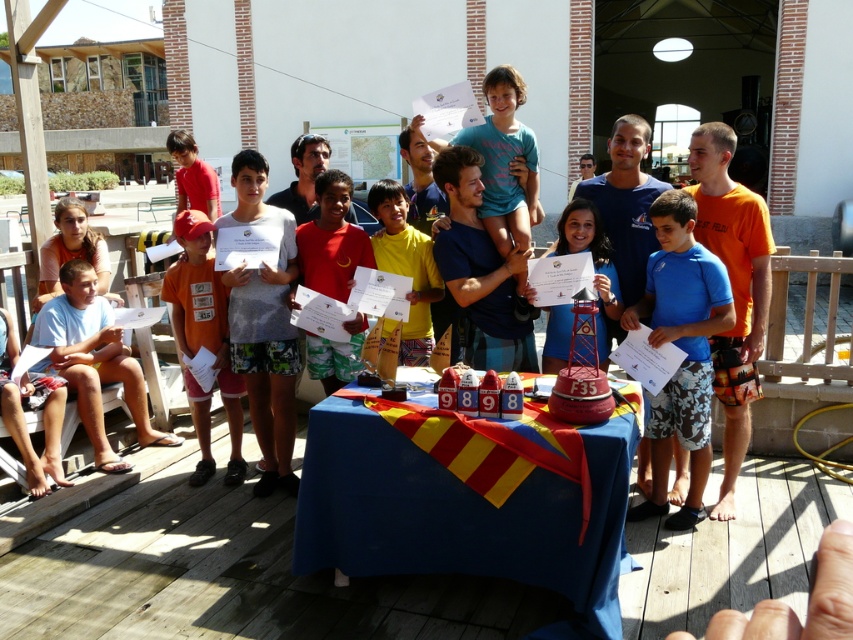
Can you confirm if matte orange t-shirt at center is shorter than yellow matte shirt at center?

In fact, matte orange t-shirt at center may be taller than yellow matte shirt at center.

I want to click on matte orange t-shirt at center, so click(x=204, y=321).

Between blue floral shorts at center and yellow matte shirt at center, which one appears on the left side from the viewer's perspective?

From the viewer's perspective, yellow matte shirt at center appears more on the left side.

Is point (668, 332) positioned after point (422, 269)?

No, it is not.

Between point (677, 525) and point (410, 260), which one is positioned behind?

The point (410, 260) is more distant.

You are a GUI agent. You are given a task and a screenshot of the screen. Output one action in this format:
    pyautogui.click(x=<x>, y=<y>)
    Task: Click on the blue floral shorts at center
    Image resolution: width=853 pixels, height=640 pixels.
    Given the screenshot: What is the action you would take?
    pyautogui.click(x=680, y=348)

Is matte orange t-shirt at center taller than red cotton shirt at center?

Yes.

Between matte orange t-shirt at center and red cotton shirt at center, which one is positioned higher?

red cotton shirt at center is higher up.

Where is `matte orange t-shirt at center`? The image size is (853, 640). matte orange t-shirt at center is located at coordinates (204, 321).

At what (x,y) coordinates should I click in order to perform the action: click on matte orange t-shirt at center. Please return your answer as a coordinate pair (x, y). Looking at the image, I should click on (204, 321).